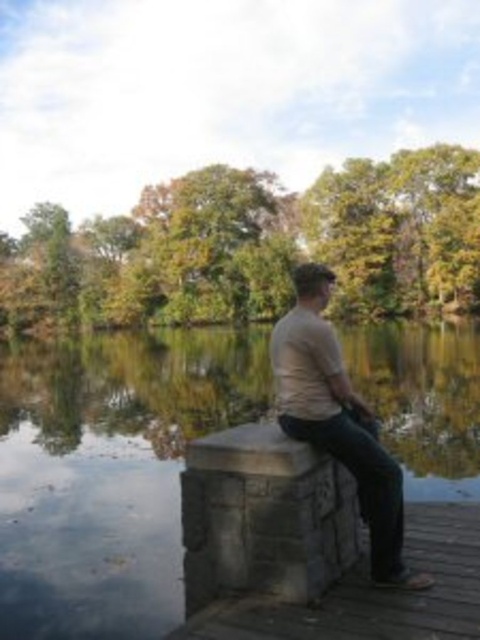
You are standing at the wooden platform and looking towards the water. There are two points marked in the image. Which point is closer to you, point (12, 636) or point (336, 410)?

Point (12, 636) is closer to you than point (336, 410) because it is further to the viewer.

You are a photographer standing at the edge of the wooden platform. You want to capture a reflection of the beige cotton shirt at center in the smooth stone lake at center. Is the position of the shirt suitable for this reflection?

The smooth stone lake at center is below the beige cotton shirt at center, so the shirt is positioned above the lake. This placement allows the lake to reflect the shirt, making it suitable for capturing the reflection.